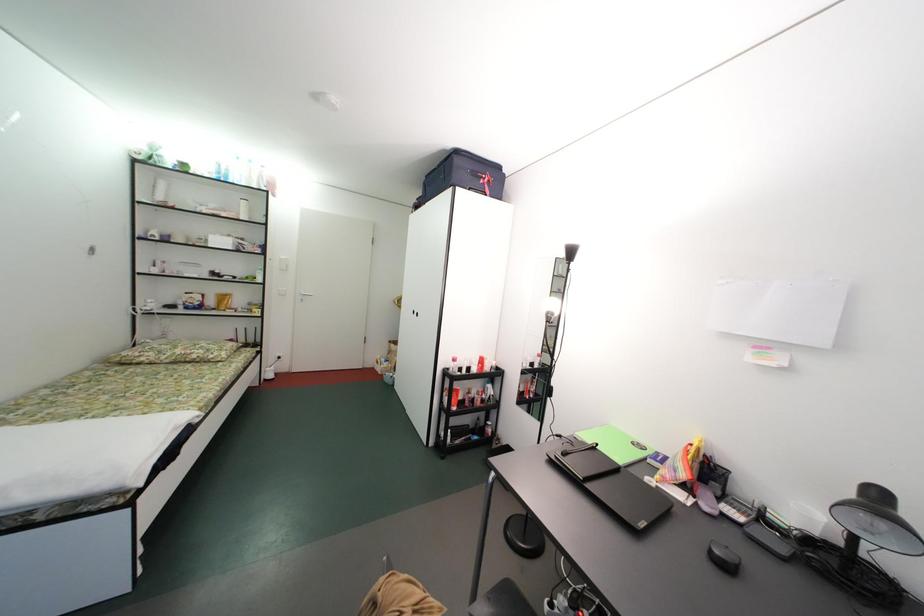
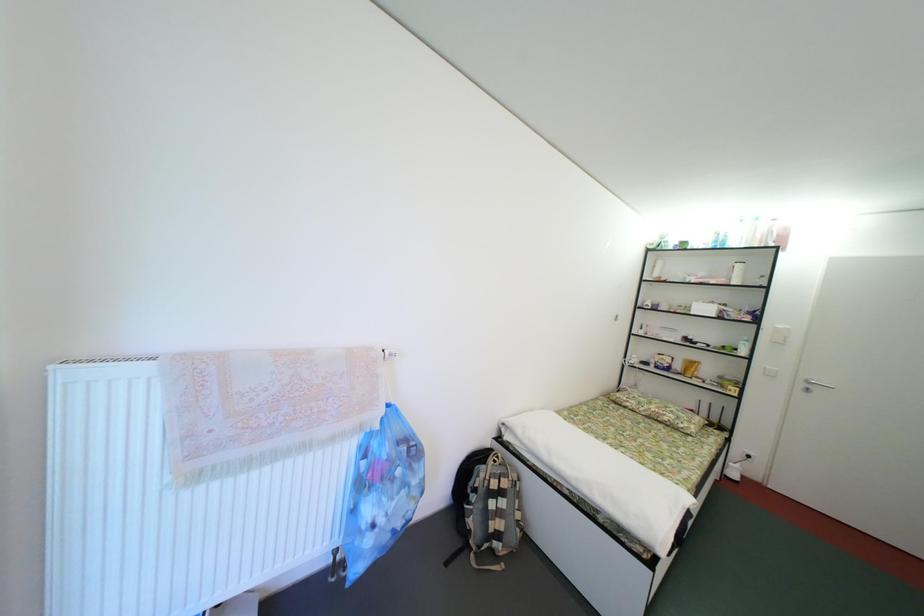
Question: Based on the continuous images, in which direction is the camera rotating? Reply with the corresponding letter.

Choices:
 (A) Left
 (B) Right
 (C) Up
 (D) Down

Answer: (A)